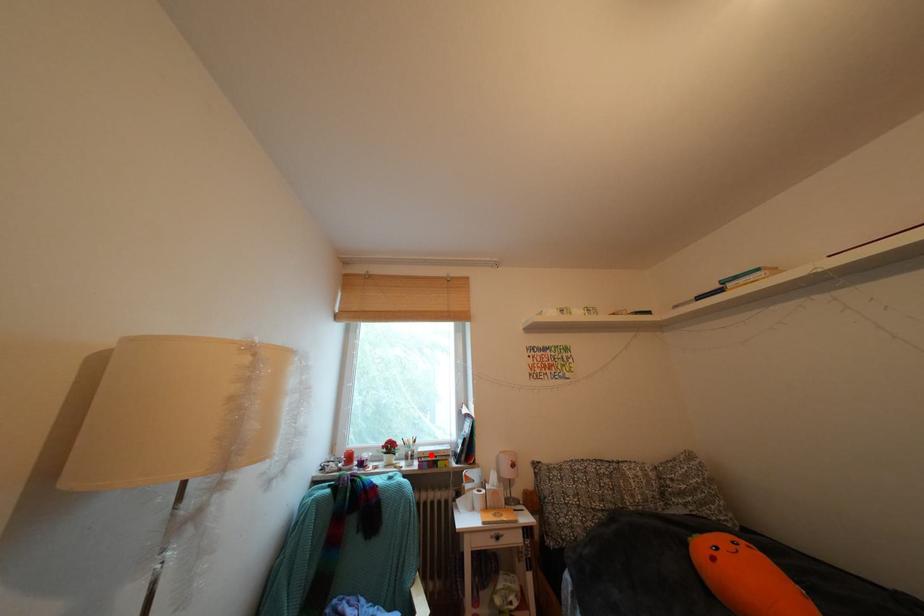
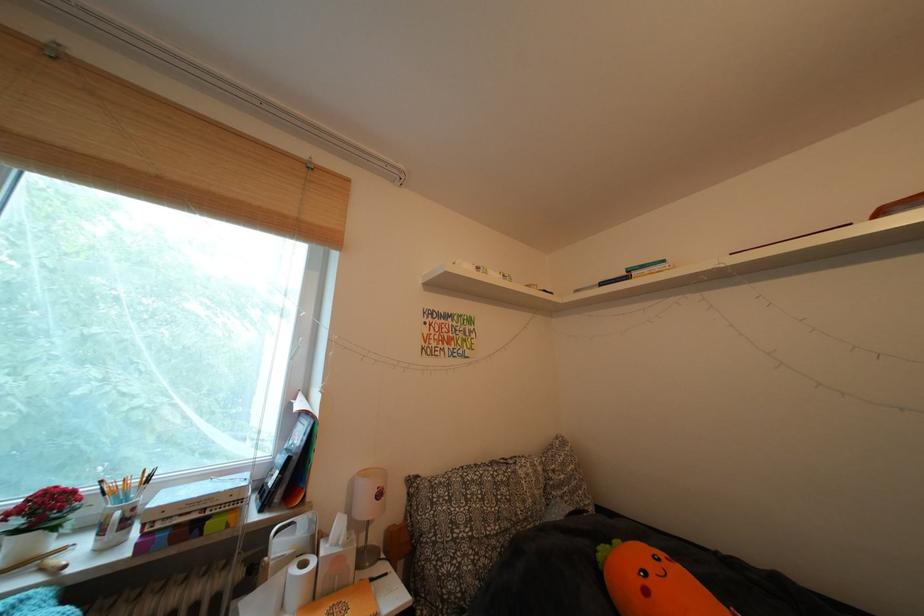
Locate, in the second image, the point that corresponds to the highlighted location in the first image.

(172, 504)